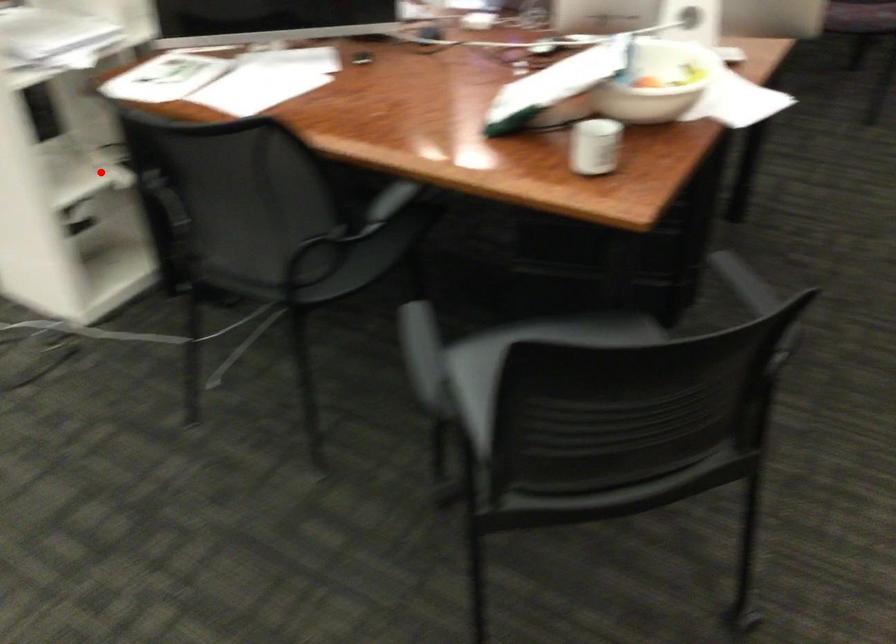
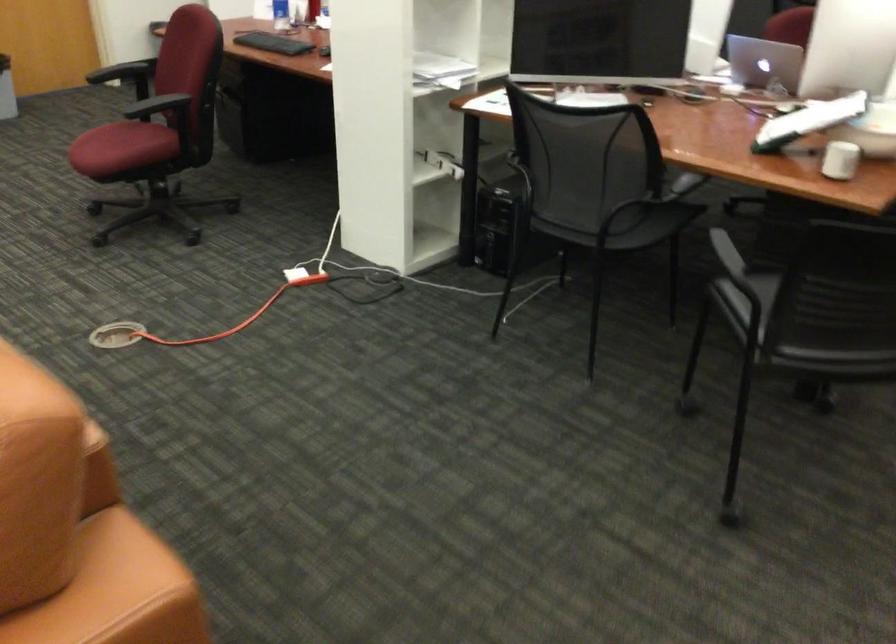
In the second image, find the point that corresponds to the highlighted location in the first image.

(444, 163)